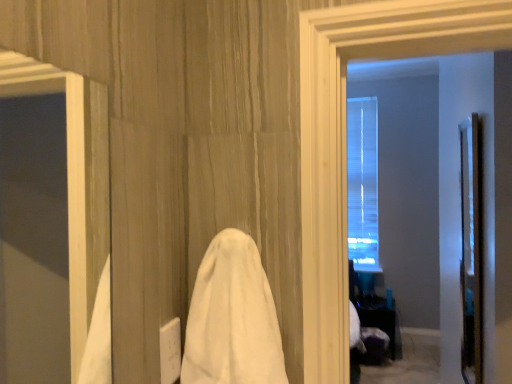
Question: Could black glossy table at lower right be considered to be inside clear glass door at right?

Choices:
 (A) no
 (B) yes

Answer: (A)

Question: Is clear glass door at right taller than black glossy table at lower right?

Choices:
 (A) yes
 (B) no

Answer: (A)

Question: Is clear glass door at right next to black glossy table at lower right?

Choices:
 (A) yes
 (B) no

Answer: (B)

Question: Can you confirm if clear glass door at right is wider than black glossy table at lower right?

Choices:
 (A) yes
 (B) no

Answer: (B)

Question: Is clear glass door at right aimed at black glossy table at lower right?

Choices:
 (A) no
 (B) yes

Answer: (A)

Question: Is point (471, 129) closer or farther from the camera than point (215, 294)?

Choices:
 (A) farther
 (B) closer

Answer: (A)

Question: Based on their positions, is clear glass door at right located to the left or right of white cloth at center?

Choices:
 (A) left
 (B) right

Answer: (B)

Question: In terms of size, does clear glass door at right appear bigger or smaller than white cloth at center?

Choices:
 (A) big
 (B) small

Answer: (A)

Question: Is clear glass door at right taller or shorter than white cloth at center?

Choices:
 (A) tall
 (B) short

Answer: (A)

Question: Looking at their shapes, would you say black glossy table at lower right is wider or thinner than white cloth at center?

Choices:
 (A) wide
 (B) thin

Answer: (A)

Question: Considering the relative positions of black glossy table at lower right and white cloth at center in the image provided, is black glossy table at lower right to the left or to the right of white cloth at center?

Choices:
 (A) left
 (B) right

Answer: (B)

Question: Is black glossy table at lower right bigger or smaller than white cloth at center?

Choices:
 (A) small
 (B) big

Answer: (B)

Question: Is point (357, 302) closer or farther from the camera than point (237, 359)?

Choices:
 (A) farther
 (B) closer

Answer: (A)

Question: Relative to clear glass door at right, is white cloth at center in front or behind?

Choices:
 (A) front
 (B) behind

Answer: (A)

Question: Visually, is white cloth at center positioned to the left or to the right of clear glass door at right?

Choices:
 (A) right
 (B) left

Answer: (B)